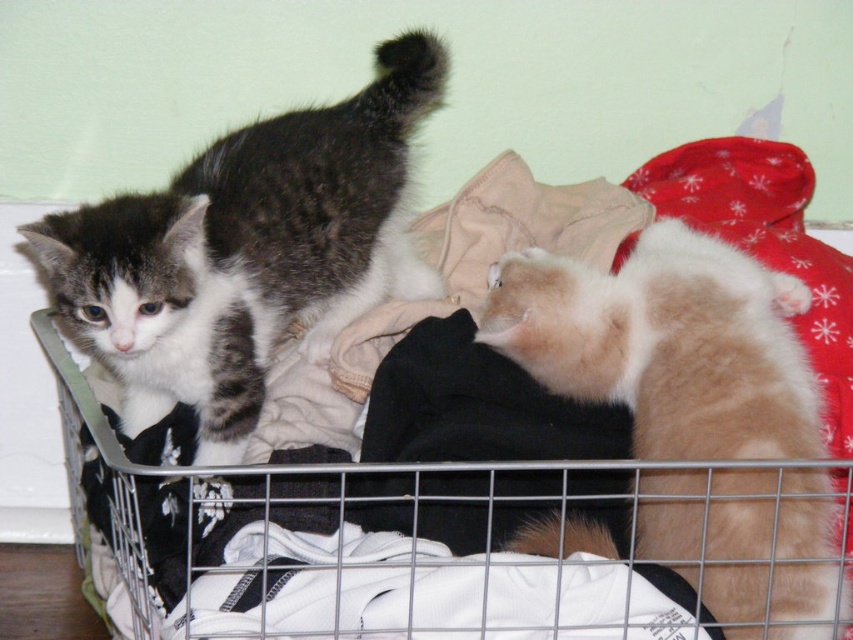
Is gray-white fur cat at left thinner than fuzzy beige cat at lower right?

No, gray-white fur cat at left is not thinner than fuzzy beige cat at lower right.

Who is lower down, gray-white fur cat at left or fuzzy beige cat at lower right?

Positioned lower is fuzzy beige cat at lower right.

Is point (247, 273) more distant than point (630, 323)?

Yes, point (247, 273) is farther from viewer.

This screenshot has height=640, width=853. I want to click on gray-white fur cat at left, so click(247, 252).

Image resolution: width=853 pixels, height=640 pixels. What are the coordinates of `metallic silver shopping basket at center` in the screenshot? It's located at (376, 516).

Is point (514, 413) positioned behind point (519, 276)?

No, it is in front of (519, 276).

Is point (90, 394) positioned before point (712, 490)?

That is False.

At what (x,y) coordinates should I click in order to perform the action: click on metallic silver shopping basket at center. Please return your answer as a coordinate pair (x, y). Looking at the image, I should click on [376, 516].

Describe the element at coordinates (376, 516) in the screenshot. I see `metallic silver shopping basket at center` at that location.

How distant is metallic silver shopping basket at center from gray-white fur cat at left?

metallic silver shopping basket at center is 6.01 inches away from gray-white fur cat at left.

The width and height of the screenshot is (853, 640). Describe the element at coordinates (376, 516) in the screenshot. I see `metallic silver shopping basket at center` at that location.

Locate an element on the screen. This screenshot has width=853, height=640. metallic silver shopping basket at center is located at coordinates pyautogui.click(x=376, y=516).